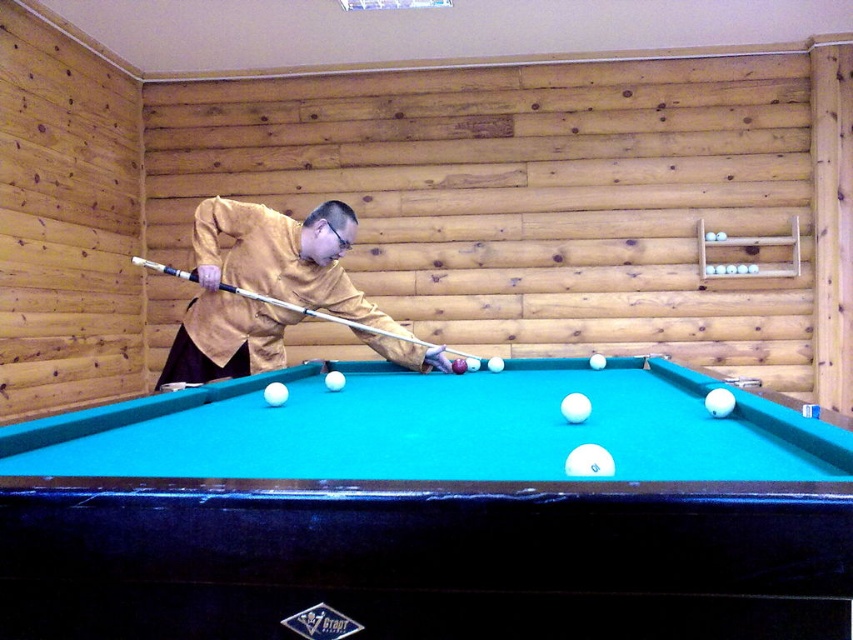
Question: Does teal felt billiard table at center appear under matte yellow shirt at center?

Choices:
 (A) yes
 (B) no

Answer: (A)

Question: Which point is closer to the camera?

Choices:
 (A) teal felt billiard table at center
 (B) matte yellow shirt at center
 (C) white plastic cue at center

Answer: (A)

Question: Is teal felt billiard table at center smaller than white plastic cue at center?

Choices:
 (A) no
 (B) yes

Answer: (A)

Question: Which object appears closest to the camera in this image?

Choices:
 (A) teal felt billiard table at center
 (B) matte yellow shirt at center
 (C) white plastic cue at center

Answer: (A)

Question: Considering the real-world distances, which object is closest to the white plastic cue at center?

Choices:
 (A) teal felt billiard table at center
 (B) matte yellow shirt at center

Answer: (B)

Question: Can you confirm if teal felt billiard table at center is thinner than matte yellow shirt at center?

Choices:
 (A) yes
 (B) no

Answer: (B)